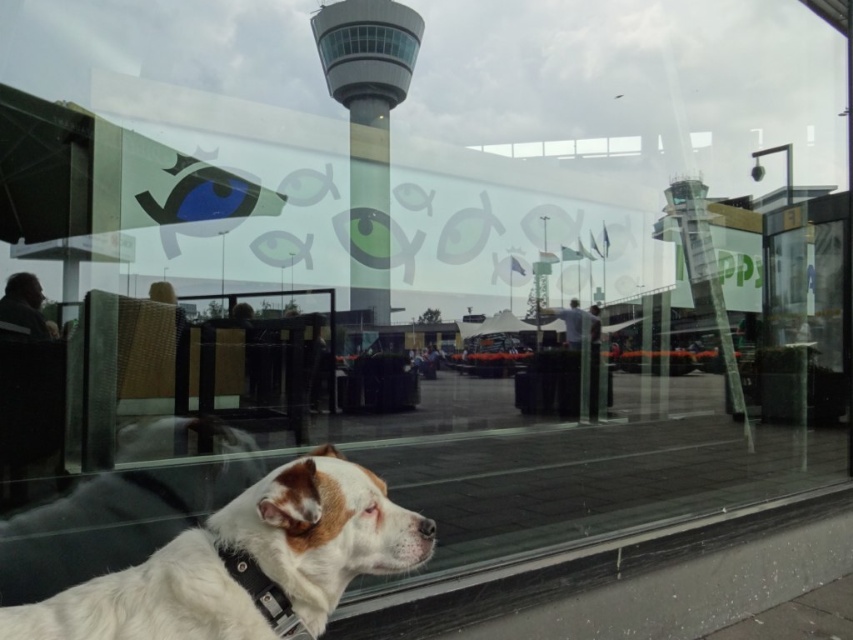
You are a visitor at the airport and want to take a photo of the smooth glass control tower at center without the white fur dog at lower left blocking it. Which object should you move closer to, and why?

You should move closer to the smooth glass control tower at center because the white fur dog at lower left is wider than the control tower, so reducing the distance to the control tower will make the dog appear smaller in the frame, allowing you to avoid it blocking the tower.

You are a security guard at the airport. You see the white fur dog at lower left and the black leather neckband at lower left. Which object is closer to you?

The white fur dog at lower left is closer to you because it is in front of the black leather neckband at lower left.